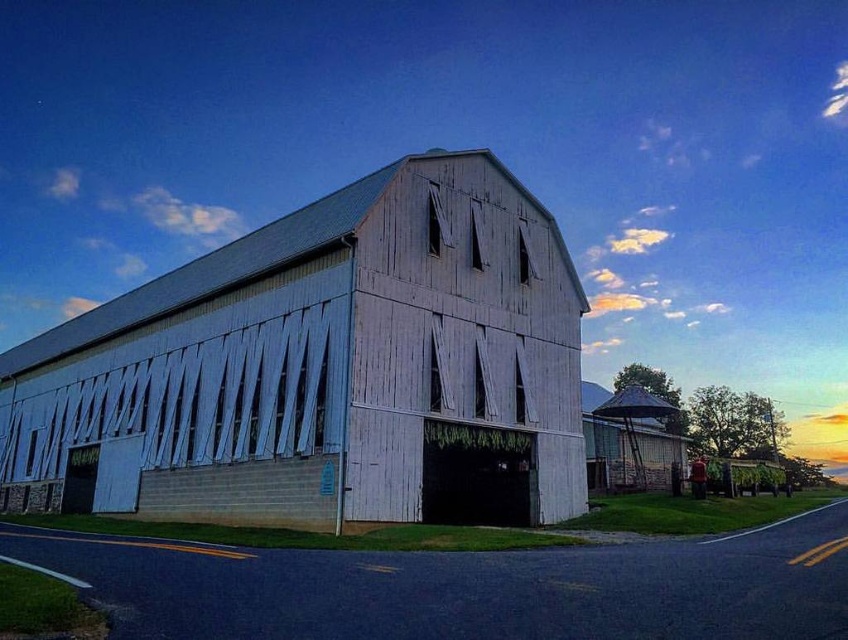
Question: Can you confirm if white wood barn at center is bigger than rustic wood silo at right?

Choices:
 (A) no
 (B) yes

Answer: (B)

Question: Does white wood barn at center have a larger size compared to rustic wood silo at right?

Choices:
 (A) no
 (B) yes

Answer: (B)

Question: Which point is closer to the camera?

Choices:
 (A) rustic wood silo at right
 (B) white wood barn at center

Answer: (B)

Question: Is white wood barn at center closer to the viewer compared to rustic wood silo at right?

Choices:
 (A) yes
 (B) no

Answer: (A)

Question: Which object is farther from the camera taking this photo?

Choices:
 (A) white wood barn at center
 (B) rustic wood silo at right

Answer: (B)